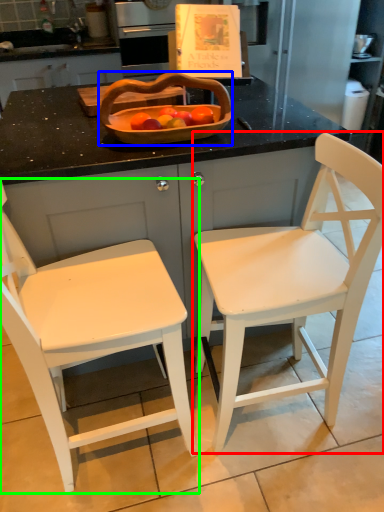
Question: Which object is the farthest from chair (highlighted by a red box)? Choose among these: basket (highlighted by a blue box) or chair (highlighted by a green box).

Choices:
 (A) basket
 (B) chair

Answer: (A)